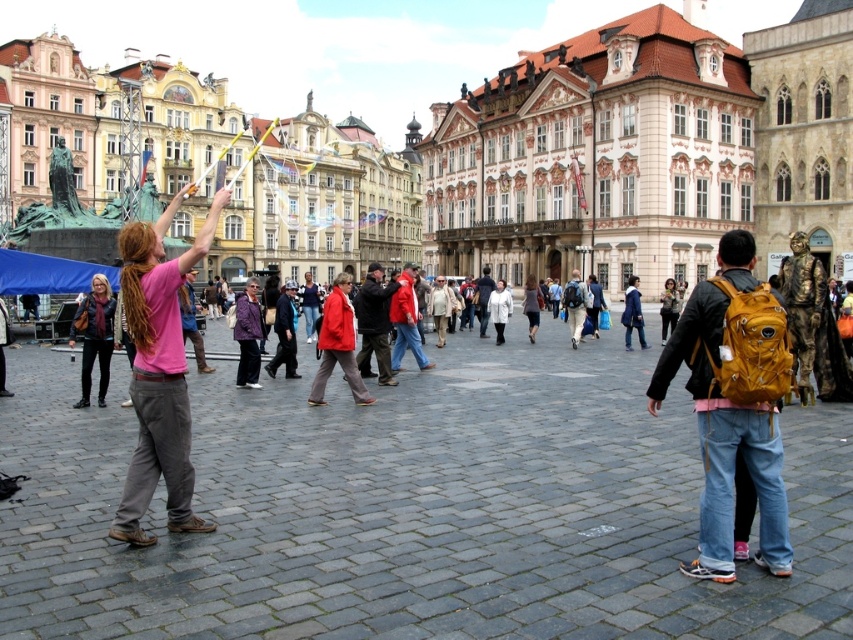
Which is in front, point (749, 259) or point (91, 321)?

Positioned in front is point (749, 259).

Which of these two, matte yellow backpack at right or leather jacket at center, stands shorter?

leather jacket at center is shorter.

At what (x,y) coordinates should I click in order to perform the action: click on matte yellow backpack at right. Please return your answer as a coordinate pair (x, y). The height and width of the screenshot is (640, 853). Looking at the image, I should click on (733, 403).

Where is `matte yellow backpack at right`? This screenshot has height=640, width=853. matte yellow backpack at right is located at coordinates (733, 403).

Based on the photo, is matte yellow backpack at right to the left of pink fabric shirt at left from the viewer's perspective?

In fact, matte yellow backpack at right is to the right of pink fabric shirt at left.

Can you confirm if matte yellow backpack at right is positioned above pink fabric shirt at left?

No.

Does point (704, 461) lie behind point (196, 253)?

No.

The width and height of the screenshot is (853, 640). What are the coordinates of `matte yellow backpack at right` in the screenshot? It's located at (733, 403).

In the scene shown: Who is lower down, pink fabric shirt at left or leather jacket at center?

leather jacket at center is below.

Can you confirm if pink fabric shirt at left is wider than leather jacket at center?

Indeed, pink fabric shirt at left has a greater width compared to leather jacket at center.

Is point (138, 310) in front of point (90, 371)?

Yes.

The image size is (853, 640). I want to click on pink fabric shirt at left, so click(160, 372).